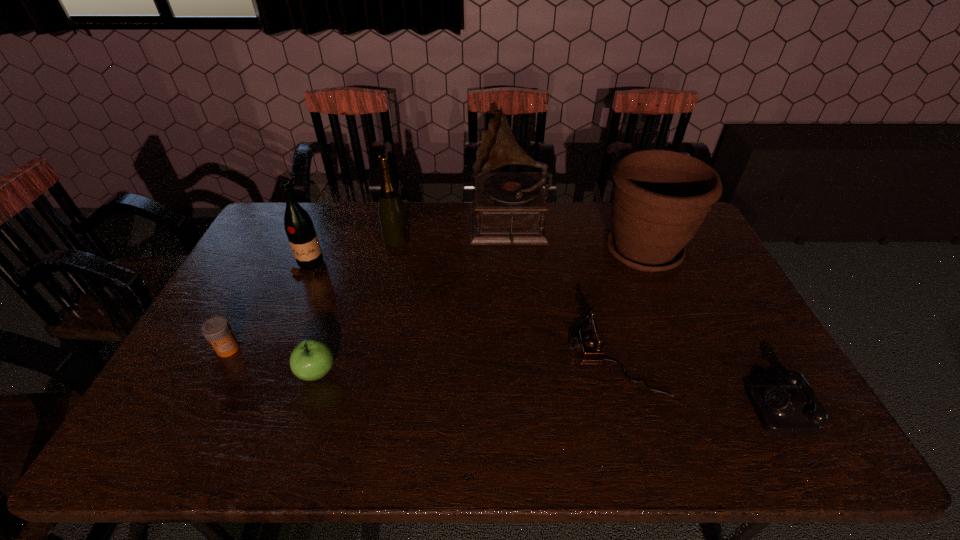
You are a GUI agent. You are given a task and a screenshot of the screen. Output one action in this format:
    pyautogui.click(x=<x>, y=<y>)
    Task: Click on the vacant region that satisfies the following two spatial constraints: 1. from the horn of the tallest object; 2. on the surface of the second object from left to right
    Image resolution: width=960 pixels, height=540 pixels.
    Given the screenshot: What is the action you would take?
    pyautogui.click(x=513, y=267)

The height and width of the screenshot is (540, 960). I want to click on vacant space that satisfies the following two spatial constraints: 1. on the front side of the flowerpot; 2. on the dial of the left telephone, so click(688, 359).